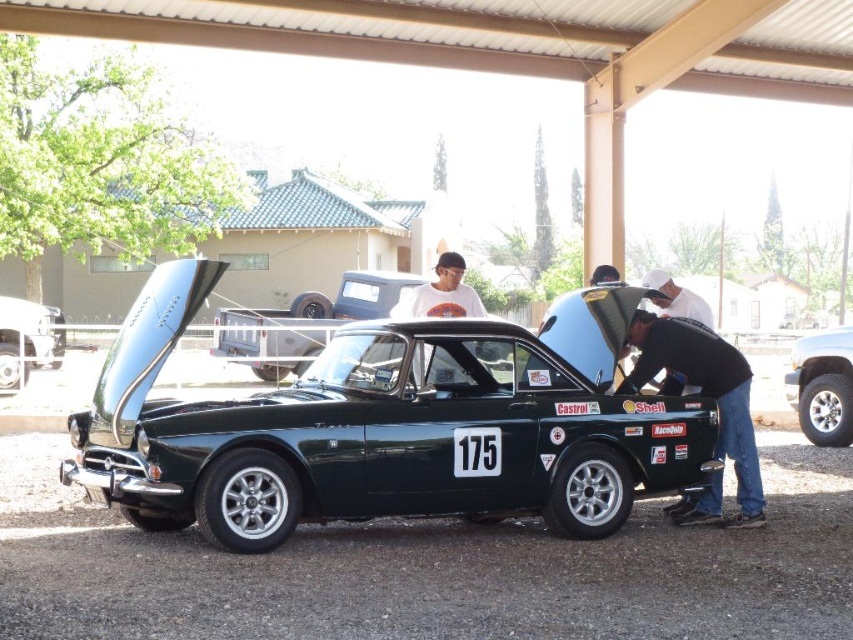
Is white cotton shirt at upper center smaller than shiny silver car at center?

Yes.

What do you see at coordinates (440, 292) in the screenshot? I see `white cotton shirt at upper center` at bounding box center [440, 292].

The width and height of the screenshot is (853, 640). What do you see at coordinates (440, 292) in the screenshot? I see `white cotton shirt at upper center` at bounding box center [440, 292].

The height and width of the screenshot is (640, 853). In order to click on white cotton shirt at upper center in this screenshot , I will do `click(440, 292)`.

Does shiny dark green car at center have a greater height compared to silver metallic tire at lower right?

No.

Consider the image. Who is lower down, shiny dark green car at center or silver metallic tire at lower right?

shiny dark green car at center is below.

Who is more forward, (x=241, y=474) or (x=838, y=328)?

Point (x=241, y=474) is in front.

This screenshot has height=640, width=853. Find the location of `shiny dark green car at center`. shiny dark green car at center is located at coordinates (387, 426).

Is shiny dark green car at center thinner than white cotton shirt at upper center?

Yes, shiny dark green car at center is thinner than white cotton shirt at upper center.

Can you confirm if shiny dark green car at center is positioned above white cotton shirt at upper center?

No.

The height and width of the screenshot is (640, 853). In order to click on shiny dark green car at center in this screenshot , I will do `click(387, 426)`.